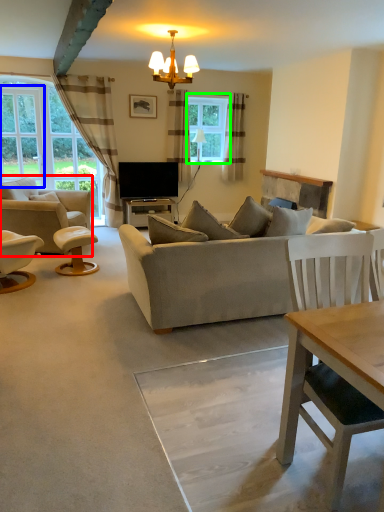
Question: Which object is the farthest from chair (highlighted by a red box)? Choose among these: window screen (highlighted by a blue box) or window (highlighted by a green box).

Choices:
 (A) window screen
 (B) window

Answer: (B)